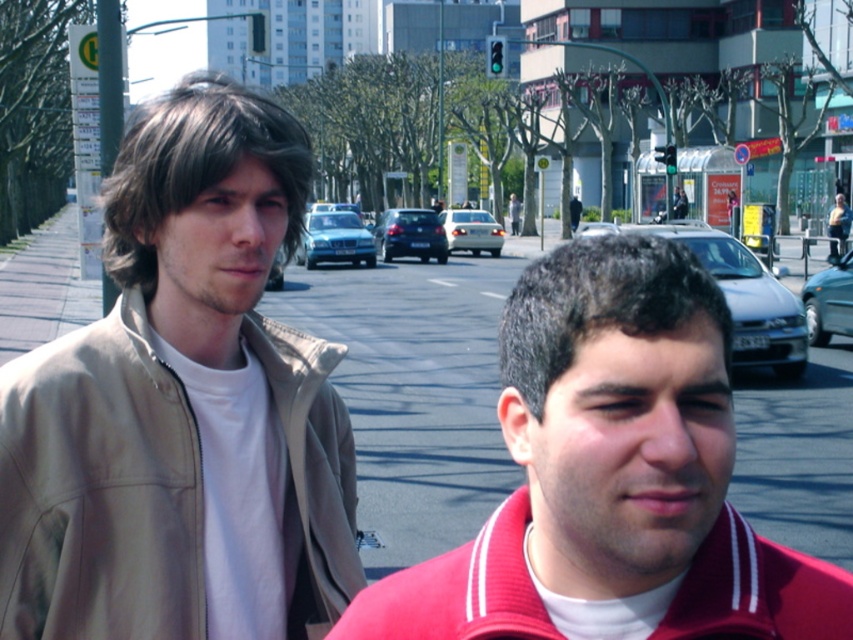
You are standing at the center of the image. There is a point marked at coordinates point (828,301). What object is located at that point?

The point (828,301) corresponds to the teal glossy sedan at right.

You are a delivery person who needs to park your vehicle in a space that can only accommodate cars smaller than your current vehicle. You see a shiny black sedan at center and a teal glossy sedan at right. Which car should you choose to park in the space?

The teal glossy sedan at right is smaller than the shiny black sedan at center, so you should choose the teal glossy sedan at right to park in the space since it is smaller and fits better.

You are a pedestrian standing at the edge of the road. You see the red fleece sweatshirt at lower right and the shiny black sedan at center. Which object is closer to the ground?

The red fleece sweatshirt at lower right is below the shiny black sedan at center, so it is closer to the ground.